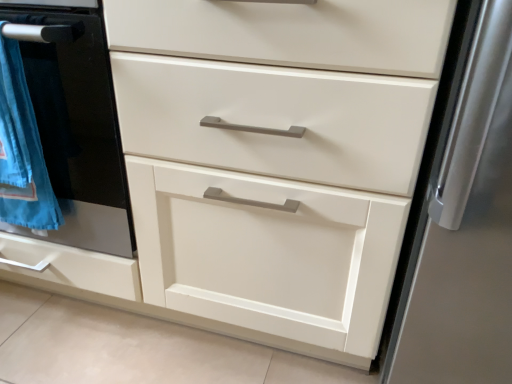
Question: In terms of height, does blue cotton towel at left look taller or shorter compared to matte black oven at left?

Choices:
 (A) tall
 (B) short

Answer: (B)

Question: From a real-world perspective, relative to matte black oven at left, is blue cotton towel at left vertically above or below?

Choices:
 (A) below
 (B) above

Answer: (B)

Question: From the image's perspective, relative to matte black oven at left, is blue cotton towel at left above or below?

Choices:
 (A) above
 (B) below

Answer: (B)

Question: Do you think matte black oven at left is within blue cotton towel at left, or outside of it?

Choices:
 (A) inside
 (B) outside

Answer: (B)

Question: Considering their positions, is matte black oven at left located in front of or behind blue cotton towel at left?

Choices:
 (A) front
 (B) behind

Answer: (A)

Question: Is matte black oven at left to the left or to the right of blue cotton towel at left in the image?

Choices:
 (A) right
 (B) left

Answer: (A)

Question: Considering the positions of matte black oven at left and blue cotton towel at left in the image, is matte black oven at left bigger or smaller than blue cotton towel at left?

Choices:
 (A) small
 (B) big

Answer: (B)